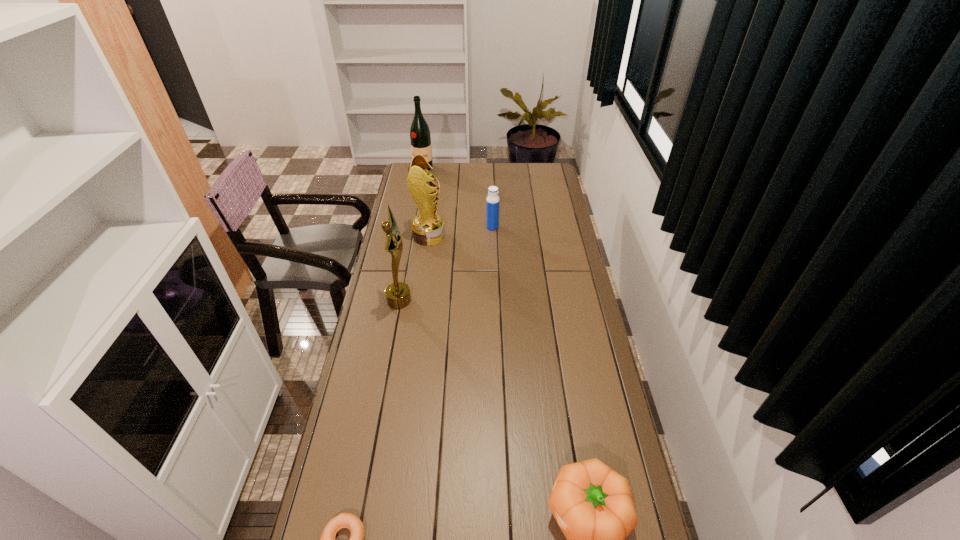
This screenshot has width=960, height=540. I want to click on wine bottle that is at the left edge, so click(420, 137).

I want to click on object situated at the far left corner, so point(420,137).

Identify the location of free space at the far edge of the desktop. (465, 181).

Find the location of a particular element. This screenshot has width=960, height=540. vacant area at the left edge of the desktop is located at coordinates (375, 329).

Where is `free space at the right edge of the desktop`? This screenshot has height=540, width=960. free space at the right edge of the desktop is located at coordinates (557, 202).

You are a GUI agent. You are given a task and a screenshot of the screen. Output one action in this format:
    pyautogui.click(x=<x>, y=<y>)
    Task: Click on the empty space that is in between the fourth farthest object and the farther award
    The width and height of the screenshot is (960, 540).
    Given the screenshot: What is the action you would take?
    pyautogui.click(x=414, y=268)

Point out which object is positioned as the fifth nearest to the shortest object. Please provide its 2D coordinates. Your answer should be formatted as a tuple, i.e. [(x, y)], where the tuple contains the x and y coordinates of a point satisfying the conditions above.

[(420, 137)]

Choose which object is the second nearest neighbor to the bagel. Please provide its 2D coordinates. Your answer should be formatted as a tuple, i.e. [(x, y)], where the tuple contains the x and y coordinates of a point satisfying the conditions above.

[(397, 294)]